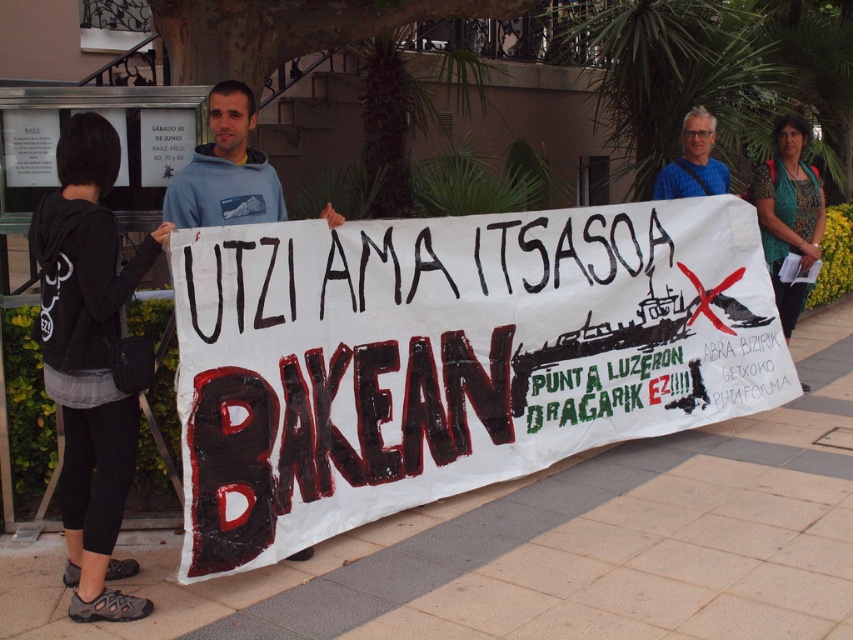
Question: Is white paper banner at center smaller than teal printed blouse at upper right?

Choices:
 (A) no
 (B) yes

Answer: (A)

Question: Estimate the real-world distances between objects in this image. Which object is closer to the blue fabric at upper center?

Choices:
 (A) black fabric hoodie at left
 (B) light blue hoodie at center
 (C) teal printed blouse at upper right

Answer: (C)

Question: Which object is farther from the camera taking this photo?

Choices:
 (A) black fabric hoodie at left
 (B) teal printed blouse at upper right
 (C) white paper banner at center

Answer: (B)

Question: Is white paper banner at center positioned behind teal printed blouse at upper right?

Choices:
 (A) no
 (B) yes

Answer: (A)

Question: Which object appears farthest from the camera in this image?

Choices:
 (A) black fabric hoodie at left
 (B) blue fabric at upper center
 (C) teal printed blouse at upper right
 (D) white paper banner at center

Answer: (C)

Question: Does white paper banner at center lie in front of teal printed blouse at upper right?

Choices:
 (A) yes
 (B) no

Answer: (A)